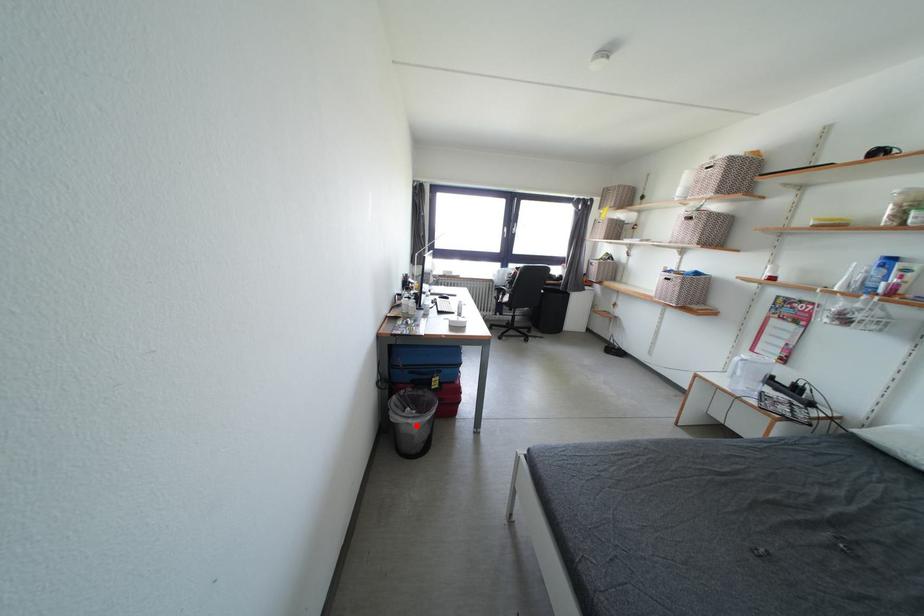
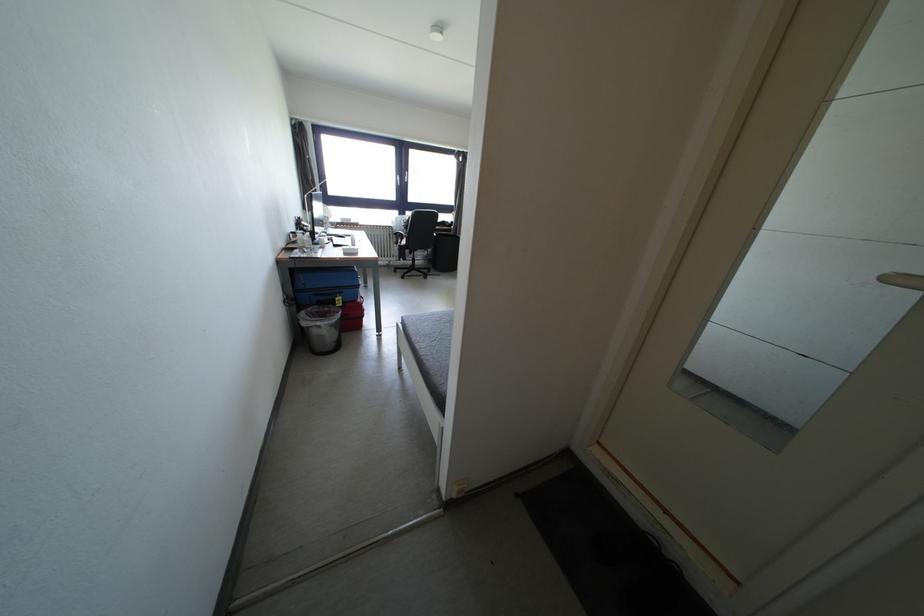
Where in the second image is the point corresponding to the highlighted location from the first image?

(324, 328)